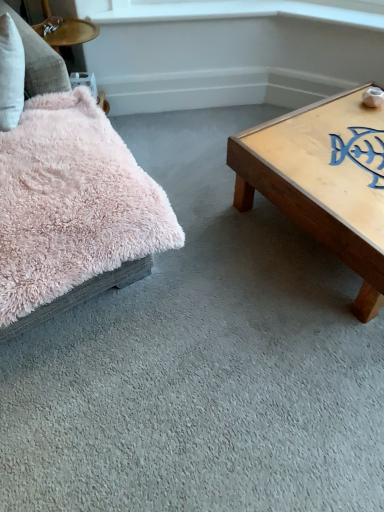
Question: From the image's perspective, does fuzzy pink pillow at upper left appear higher than fluffy pink pillow at left?

Choices:
 (A) no
 (B) yes

Answer: (B)

Question: Is fuzzy pink pillow at upper left positioned far away from fluffy pink pillow at left?

Choices:
 (A) no
 (B) yes

Answer: (A)

Question: Is fuzzy pink pillow at upper left bigger than fluffy pink pillow at left?

Choices:
 (A) no
 (B) yes

Answer: (A)

Question: Is fluffy pink pillow at left surrounded by fuzzy pink pillow at upper left?

Choices:
 (A) yes
 (B) no

Answer: (B)

Question: From a real-world perspective, is fuzzy pink pillow at upper left positioned over fluffy pink pillow at left based on gravity?

Choices:
 (A) yes
 (B) no

Answer: (A)

Question: Visually, is fluffy pink pillow at left positioned to the left or to the right of fuzzy pink pillow at upper left?

Choices:
 (A) right
 (B) left

Answer: (A)

Question: Is fluffy pink pillow at left wider or thinner than fuzzy pink pillow at upper left?

Choices:
 (A) wide
 (B) thin

Answer: (A)

Question: Do you think fluffy pink pillow at left is within fuzzy pink pillow at upper left, or outside of it?

Choices:
 (A) outside
 (B) inside

Answer: (A)

Question: Considering the positions of fluffy pink pillow at left and fuzzy pink pillow at upper left in the image, is fluffy pink pillow at left taller or shorter than fuzzy pink pillow at upper left?

Choices:
 (A) tall
 (B) short

Answer: (B)

Question: From the image's perspective, is white glossy window sill at upper center positioned above or below fluffy pink pillow at left?

Choices:
 (A) below
 (B) above

Answer: (B)

Question: From a real-world perspective, is white glossy window sill at upper center positioned above or below fluffy pink pillow at left?

Choices:
 (A) above
 (B) below

Answer: (A)

Question: Relative to fluffy pink pillow at left, is white glossy window sill at upper center in front or behind?

Choices:
 (A) front
 (B) behind

Answer: (B)

Question: Based on their positions, is white glossy window sill at upper center located to the left or right of fluffy pink pillow at left?

Choices:
 (A) right
 (B) left

Answer: (A)

Question: Based on their positions, is light brown wooden coffee table at right located to the left or right of fluffy pink pillow at left?

Choices:
 (A) left
 (B) right

Answer: (B)

Question: Looking at their shapes, would you say light brown wooden coffee table at right is wider or thinner than fluffy pink pillow at left?

Choices:
 (A) thin
 (B) wide

Answer: (B)